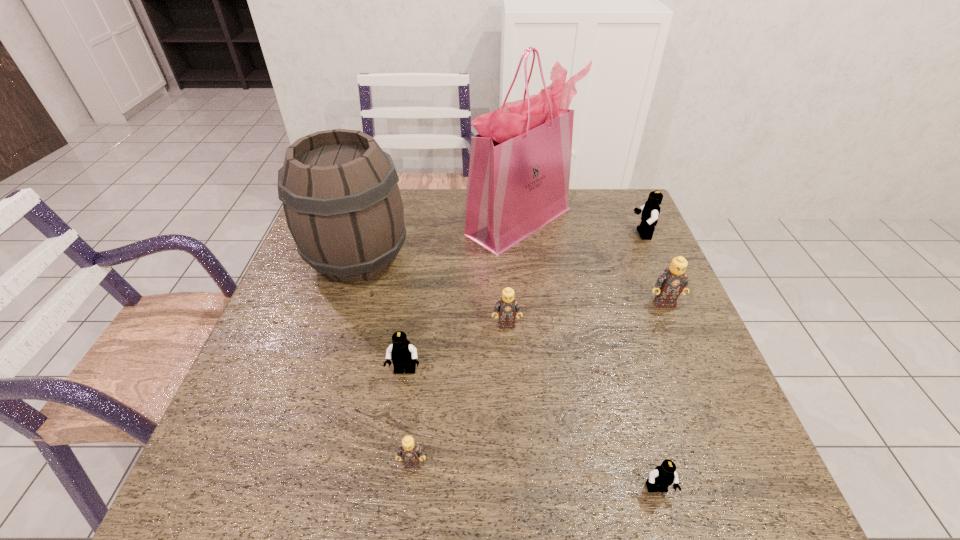
This screenshot has height=540, width=960. I want to click on free space located 0.240m in front of the farthest tan Lego, so coord(701,389).

Where is `vacant region located 0.100m in front of the second tan Lego from left to right`? vacant region located 0.100m in front of the second tan Lego from left to right is located at coordinates (509, 362).

At what (x,y) coordinates should I click in order to perform the action: click on vacant space located 0.170m on the front-facing side of the sixth farthest object. Please return your answer as a coordinate pair (x, y). Looking at the image, I should click on (392, 456).

At what (x,y) coordinates should I click in order to perform the action: click on shopping bag at the far edge. Please return your answer as a coordinate pair (x, y). Looking at the image, I should click on (519, 172).

Identify the location of wine bucket that is at the far edge. Image resolution: width=960 pixels, height=540 pixels. (343, 207).

You are a GUI agent. You are given a task and a screenshot of the screen. Output one action in this format:
    pyautogui.click(x=<x>, y=<y>)
    Task: Click on the Lego that is at the far edge
    
    Given the screenshot: What is the action you would take?
    (650, 211)

Where is `object that is at the left edge`? This screenshot has width=960, height=540. object that is at the left edge is located at coordinates (343, 207).

Where is `object that is at the far left corner`? object that is at the far left corner is located at coordinates (343, 207).

Where is `object at the far right corner`? This screenshot has height=540, width=960. object at the far right corner is located at coordinates (650, 211).

The height and width of the screenshot is (540, 960). What are the coordinates of `free space at the far edge of the desktop` in the screenshot? It's located at (412, 204).